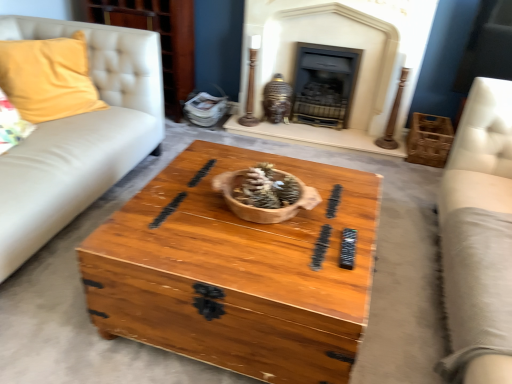
Question: Is wooden crate at right thinner than yellow fabric pillow at left?

Choices:
 (A) yes
 (B) no

Answer: (B)

Question: Does wooden crate at right lie behind yellow fabric pillow at left?

Choices:
 (A) yes
 (B) no

Answer: (A)

Question: From the image's perspective, is wooden crate at right under yellow fabric pillow at left?

Choices:
 (A) yes
 (B) no

Answer: (A)

Question: Does wooden crate at right lie in front of yellow fabric pillow at left?

Choices:
 (A) no
 (B) yes

Answer: (A)

Question: Does wooden crate at right have a lesser height compared to yellow fabric pillow at left?

Choices:
 (A) no
 (B) yes

Answer: (B)

Question: Does wooden crate at right have a larger size compared to yellow fabric pillow at left?

Choices:
 (A) yes
 (B) no

Answer: (B)

Question: From a real-world perspective, is matte black fireplace at upper center, the second fireplace from the right, located higher than light beige leather couch at right?

Choices:
 (A) yes
 (B) no

Answer: (A)

Question: Does matte black fireplace at upper center, the second fireplace from the right, appear on the left side of light beige leather couch at right?

Choices:
 (A) yes
 (B) no

Answer: (A)

Question: Is matte black fireplace at upper center, which is the first fireplace in left-to-right order, taller than light beige leather couch at right?

Choices:
 (A) no
 (B) yes

Answer: (B)

Question: From the image's perspective, is matte black fireplace at upper center, the second fireplace from the right, below light beige leather couch at right?

Choices:
 (A) yes
 (B) no

Answer: (B)

Question: Is matte black fireplace at upper center, which is the first fireplace in left-to-right order, positioned behind light beige leather couch at right?

Choices:
 (A) no
 (B) yes

Answer: (B)

Question: Is matte black fireplace at upper center, the second fireplace from the right, facing away from light beige leather couch at right?

Choices:
 (A) no
 (B) yes

Answer: (A)

Question: Is yellow fabric pillow at left positioned far away from dark gray stone fireplace at center, which appears as the second fireplace when viewed from the left?

Choices:
 (A) yes
 (B) no

Answer: (A)